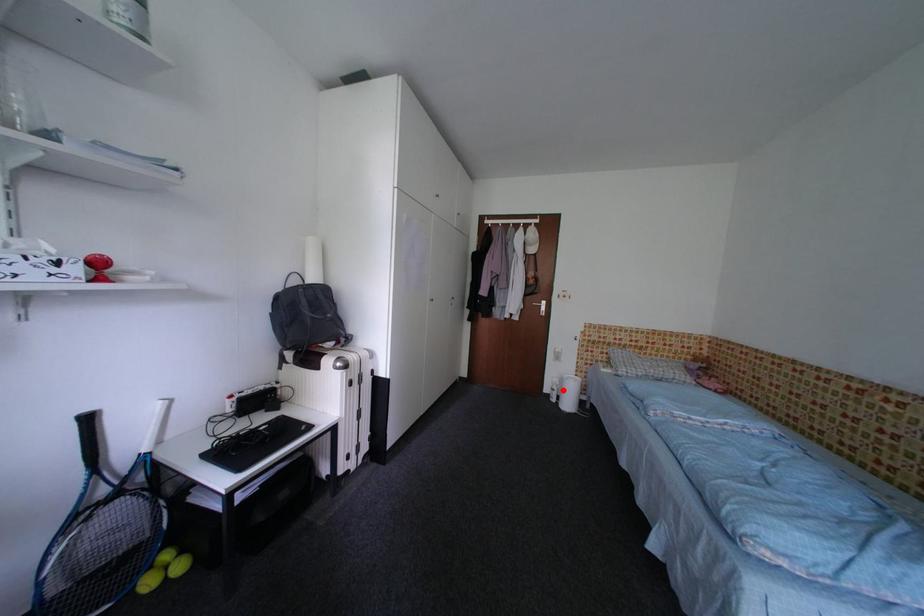
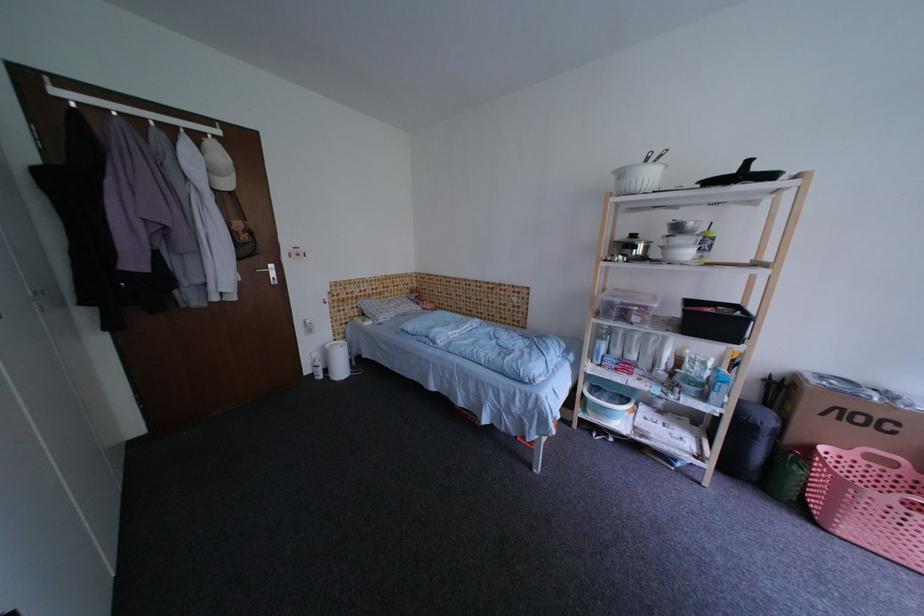
Where in the second image is the point corresponding to the highlighted location from the first image?

(326, 366)